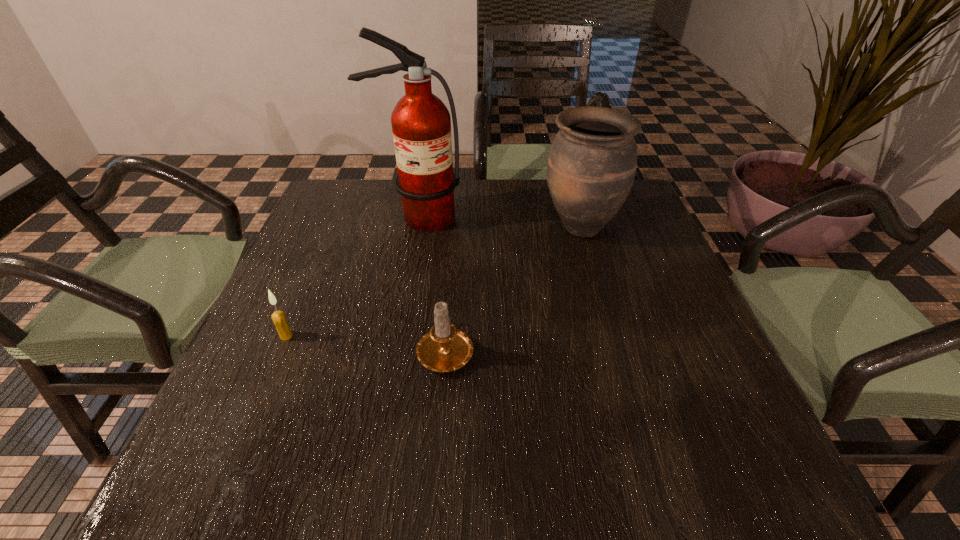
Identify the location of fire extinguisher. (421, 124).

Where is `the third shortest object`? This screenshot has width=960, height=540. the third shortest object is located at coordinates (592, 163).

Where is `urn`? urn is located at coordinates (592, 163).

Find the location of a particular element. This screenshot has width=960, height=540. the right candle is located at coordinates (445, 348).

At what (x,y) coordinates should I click in order to perform the action: click on the left candle. Please return your answer as a coordinate pair (x, y). This screenshot has height=540, width=960. Looking at the image, I should click on (279, 319).

Where is `vacant space located on the nozzle and handle of the fire extinguisher`? The image size is (960, 540). vacant space located on the nozzle and handle of the fire extinguisher is located at coordinates (400, 312).

Identify the location of vacant space located on the left of the urn. The image size is (960, 540). (439, 227).

Identify the location of vacant space located 0.130m on the right of the right candle. pyautogui.click(x=540, y=349).

At what (x,y) coordinates should I click in order to perform the action: click on vacant space located 0.210m on the front of the leftmost object. Please return your answer as a coordinate pair (x, y). The height and width of the screenshot is (540, 960). Looking at the image, I should click on pyautogui.click(x=243, y=440).

Where is `fire extinguisher that is at the far edge`? The height and width of the screenshot is (540, 960). fire extinguisher that is at the far edge is located at coordinates (421, 124).